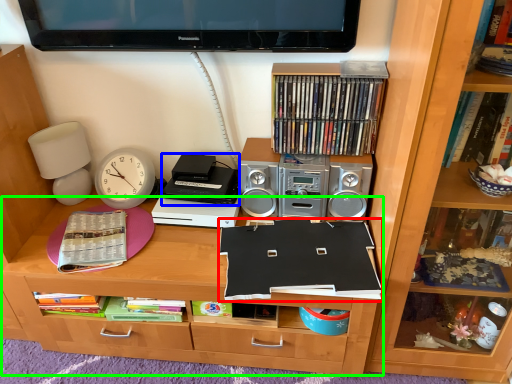
Question: Considering the real-world distances, which object is closest to paperback book (highlighted by a red box)? cassette (highlighted by a blue box) or desk (highlighted by a green box).

Choices:
 (A) cassette
 (B) desk

Answer: (B)